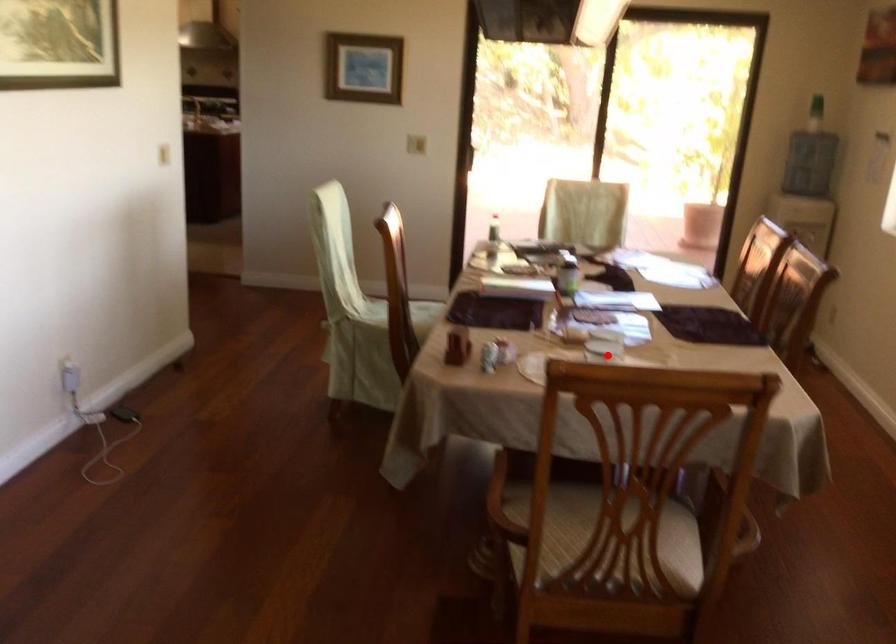
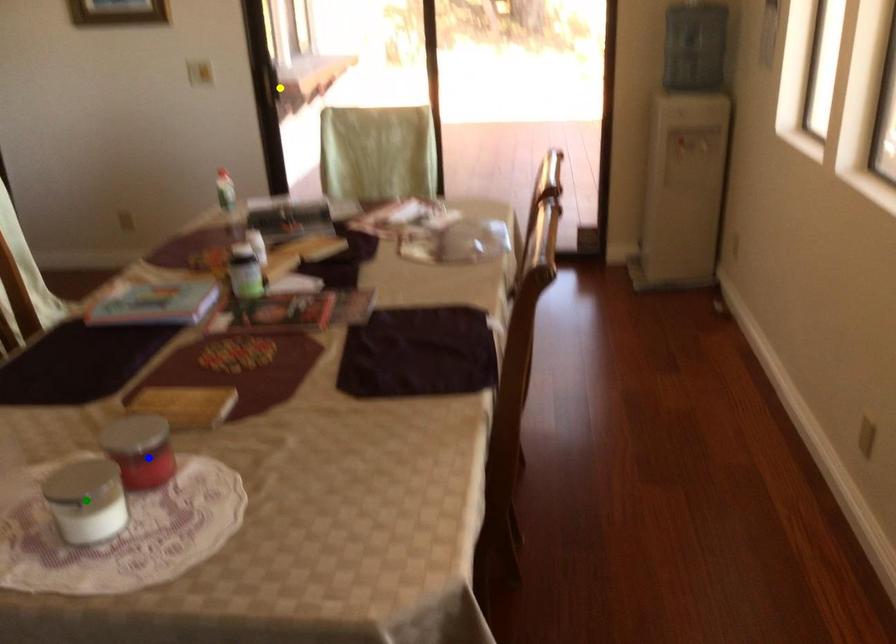
Question: I am providing you with two images of the same scene from different viewpoints. A red point is marked on the first image. You are given multiple points on the second image. Which mark in image 2 goes with the point in image 1?

Choices:
 (A) yellow point
 (B) green point
 (C) blue point

Answer: (B)